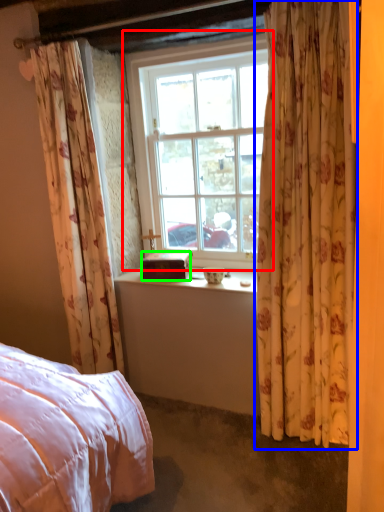
Question: Which object is positioned closest to window (highlighted by a red box)? Select from curtain (highlighted by a blue box) and box (highlighted by a green box).

Choices:
 (A) curtain
 (B) box

Answer: (B)